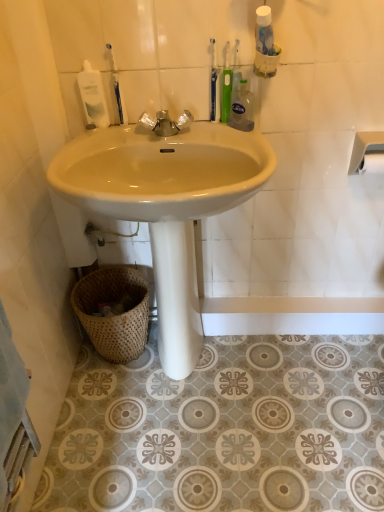
You are a GUI agent. You are given a task and a screenshot of the screen. Output one action in this format:
    pyautogui.click(x=<x>, y=<y>)
    Task: Click on the free space in front of blue plastic toothbrush at upper left, marked as the first toothbrush in a left-to-right arrangement
    This screenshot has width=384, height=512.
    Given the screenshot: What is the action you would take?
    pyautogui.click(x=105, y=141)